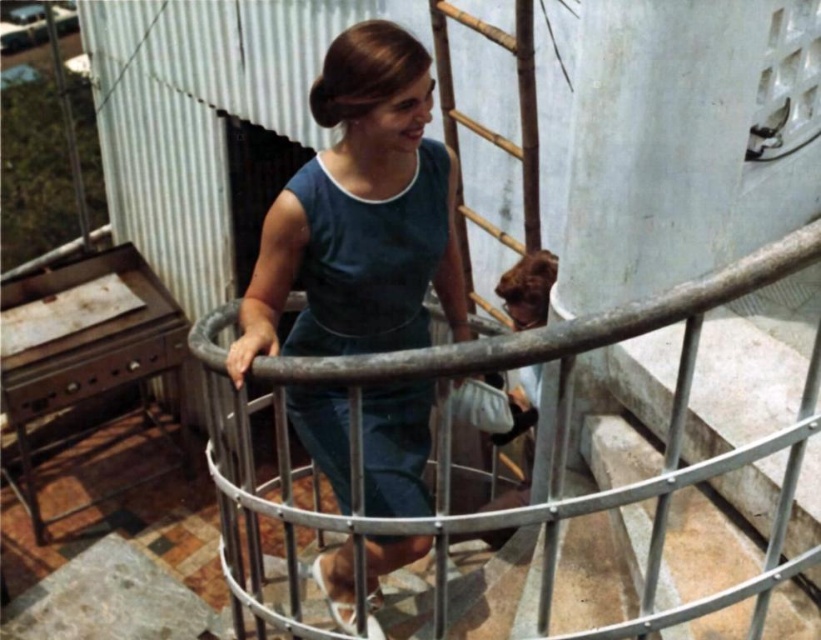
You are standing in front of the blue fabric dress at center and want to reach a button on your jacket that is 1.5 feet away from your face. Can you safely bend forward without touching the dress?

The blue fabric dress at center is 5.70 feet away from you. Since the button on your jacket is only 1.5 feet away from your face, you can safely bend forward to reach it without touching the dress.